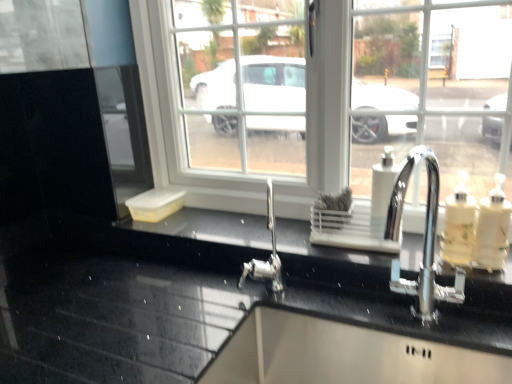
Question: From a real-world perspective, is white glossy soap dispenser at right, positioned as the 3th soap dispenser in left-to-right order, physically located above or below translucent plastic soap dispenser at right, positioned as the 2th soap dispenser in left-to-right order?

Choices:
 (A) above
 (B) below

Answer: (A)

Question: In terms of width, does white glossy soap dispenser at right, acting as the 1th soap dispenser starting from the right, look wider or thinner when compared to translucent plastic soap dispenser at right, positioned as the 2th soap dispenser in left-to-right order?

Choices:
 (A) thin
 (B) wide

Answer: (A)

Question: Which is farther from the black glossy countertop at center?

Choices:
 (A) translucent plastic soap dispenser at right, positioned as the 2th soap dispenser in right-to-left order
 (B) white plastic soap dispenser at center-right, arranged as the 1th soap dispenser when viewed from the left
 (C) white glossy soap dispenser at right, acting as the 1th soap dispenser starting from the right

Answer: (C)

Question: Estimate the real-world distances between objects in this image. Which object is closer to the translucent plastic soap dispenser at right, positioned as the 2th soap dispenser in left-to-right order?

Choices:
 (A) black glossy countertop at center
 (B) white plastic soap dispenser at center-right, marked as the third soap dispenser in a right-to-left arrangement
 (C) white glossy soap dispenser at right, acting as the 1th soap dispenser starting from the right

Answer: (C)